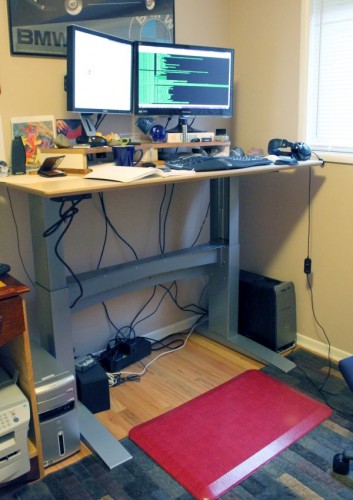
Find the location of a particular element. light brown wood flooring is located at coordinates (174, 366).